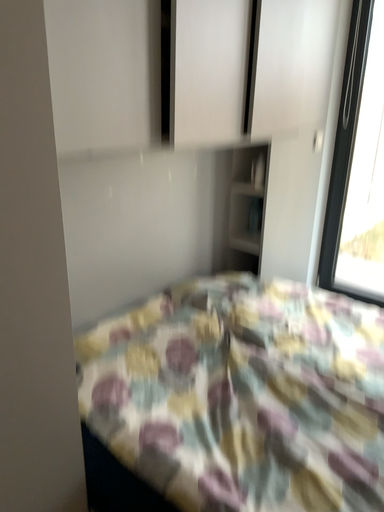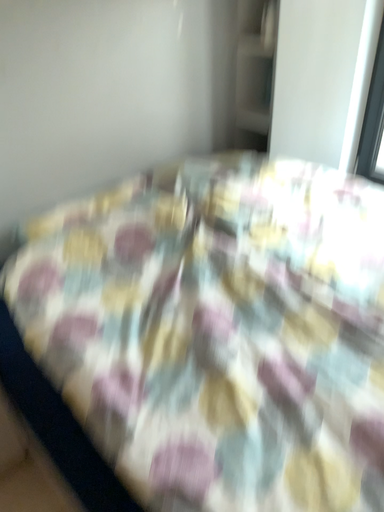
Question: Which way did the camera rotate in the video?

Choices:
 (A) rotated right
 (B) rotated left

Answer: (B)